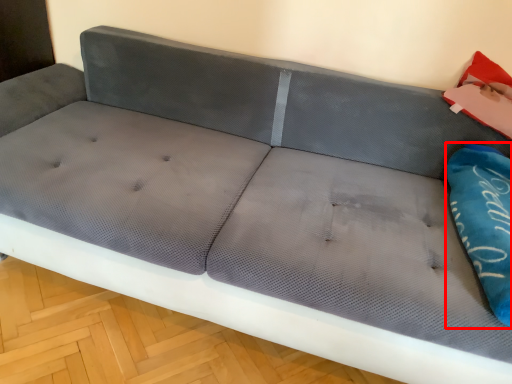
Question: In this image, where is pillow (annotated by the red box) located relative to material?

Choices:
 (A) left
 (B) right

Answer: (A)